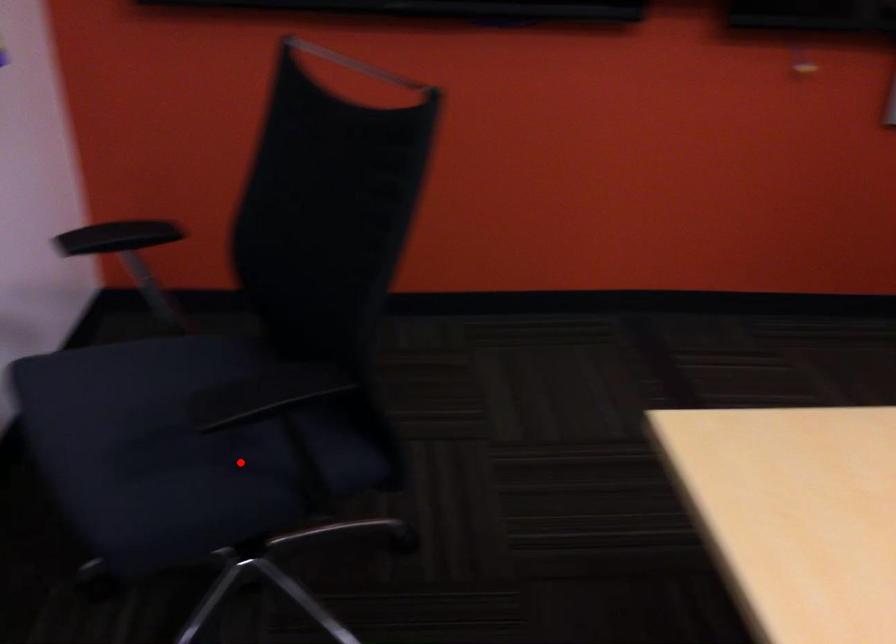
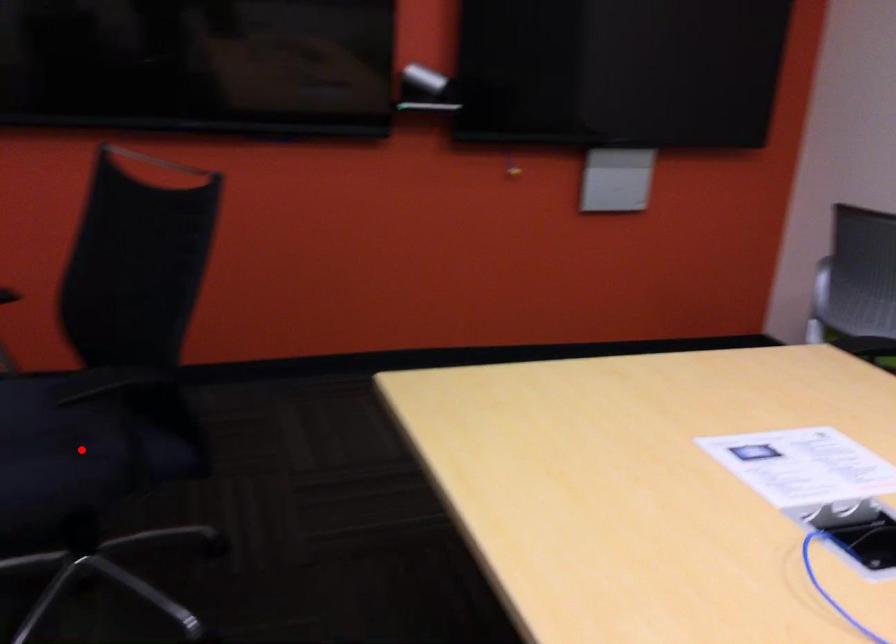
I am providing you with two images of the same scene from different viewpoints. A red point is marked on the first image and another point is marked on the second image. Is the marked point in image1 the same physical position as the marked point in image2?

Yes